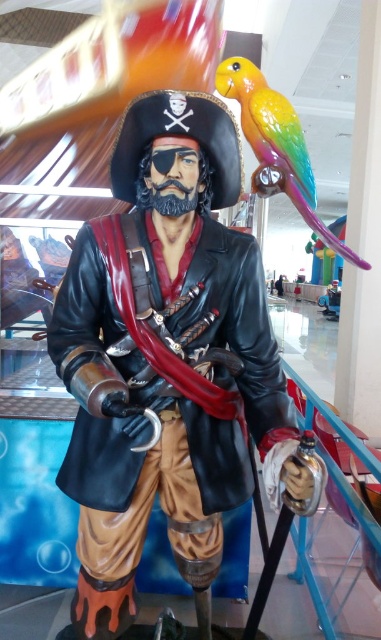
This screenshot has height=640, width=381. In order to click on glossy black pirate at center in this screenshot , I will do `click(166, 358)`.

Who is taller, glossy black pirate at center or rainbow glossy parrot at upper right?

glossy black pirate at center

The height and width of the screenshot is (640, 381). Find the location of `glossy black pirate at center`. glossy black pirate at center is located at coordinates (166, 358).